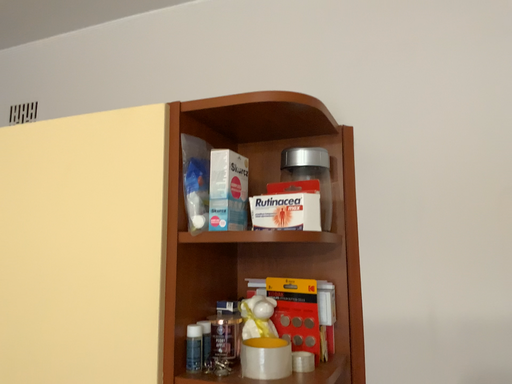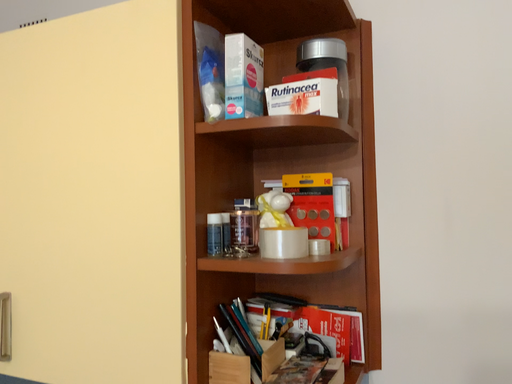
Question: Which way did the camera rotate in the video?

Choices:
 (A) rotated downward
 (B) rotated upward

Answer: (A)